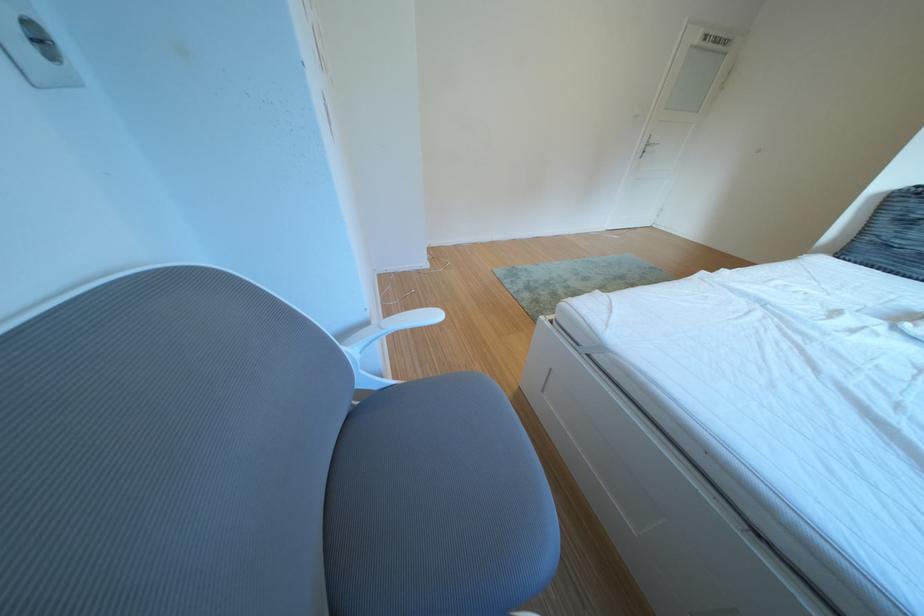
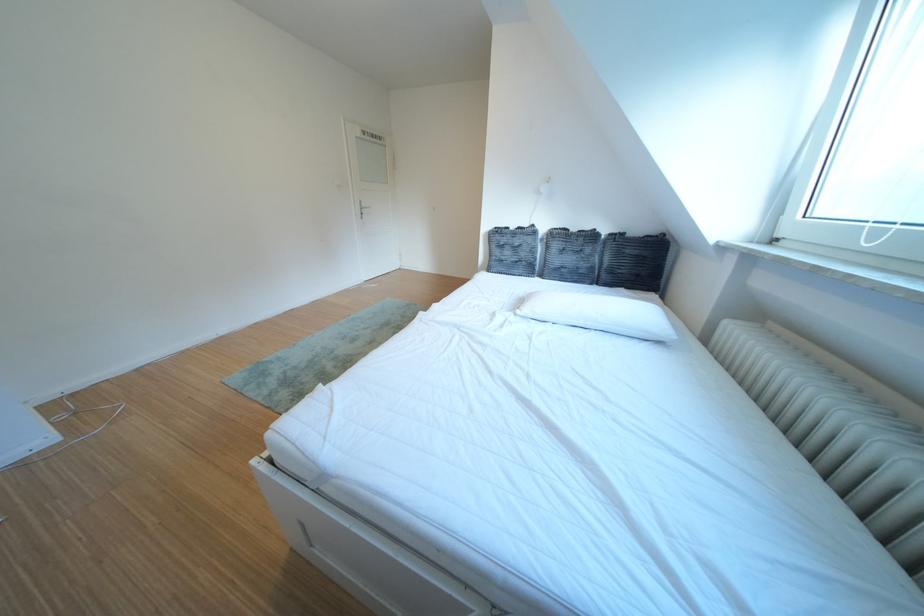
Question: The camera is either moving clockwise (left) or counter-clockwise (right) around the object. The first image is from the beginning of the video and the second image is from the end. Is the camera moving left or right when shooting the video?

Choices:
 (A) Left
 (B) Right

Answer: (A)